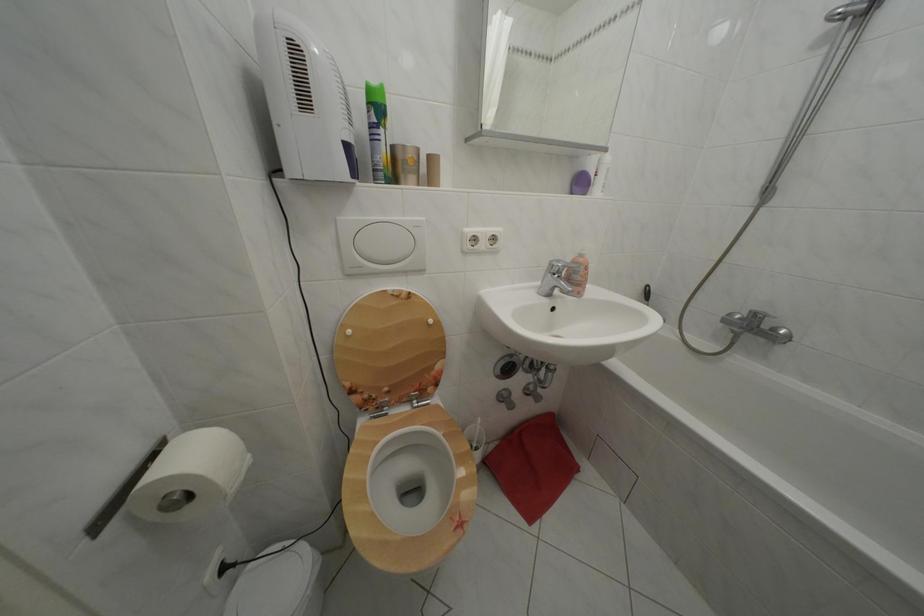
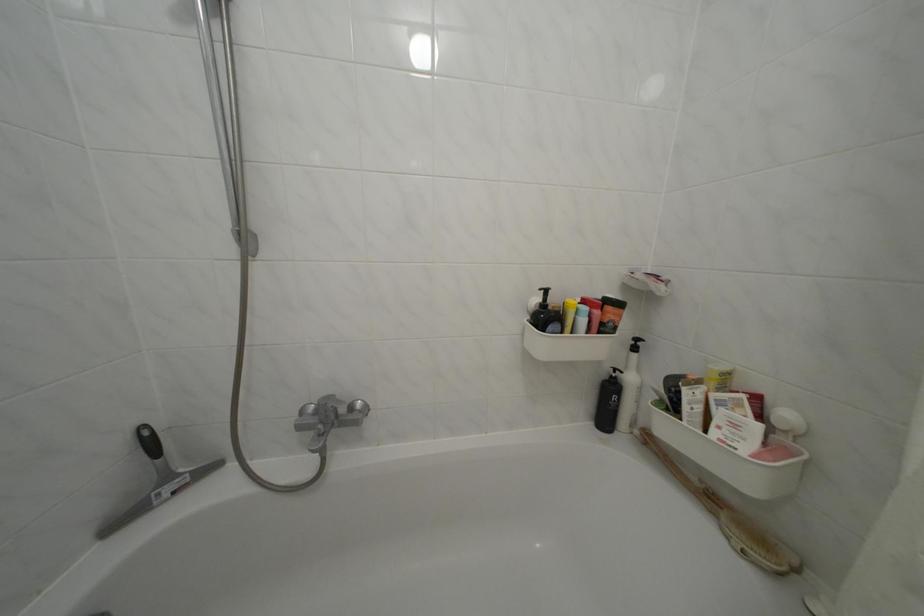
Question: The camera is either moving clockwise (left) or counter-clockwise (right) around the object. The first image is from the beginning of the video and the second image is from the end. Is the camera moving left or right when shooting the video?

Choices:
 (A) Left
 (B) Right

Answer: (A)